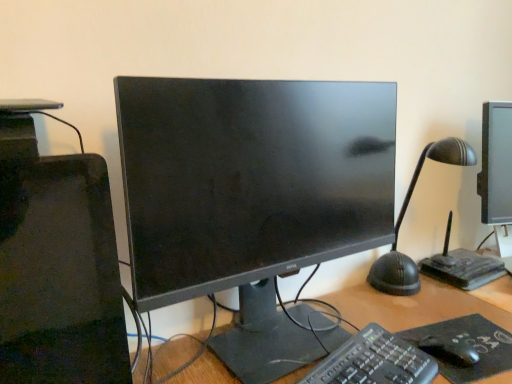
You are a GUI agent. You are given a task and a screenshot of the screen. Output one action in this format:
    pyautogui.click(x=<x>, y=<y>)
    Task: Click on the vacant space behind black matte mouse at lower right
    The image size is (512, 384).
    Given the screenshot: What is the action you would take?
    pyautogui.click(x=438, y=325)